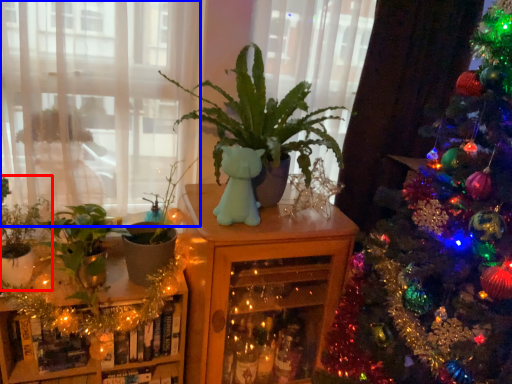
Question: Which point is further to the camera, houseplant (highlighted by a red box) or window (highlighted by a blue box)?

Choices:
 (A) houseplant
 (B) window

Answer: (A)